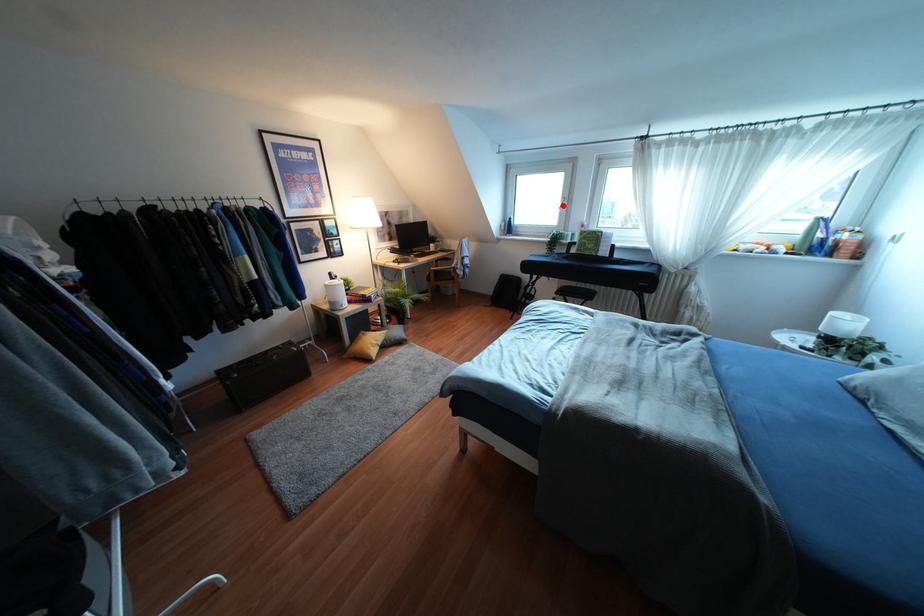
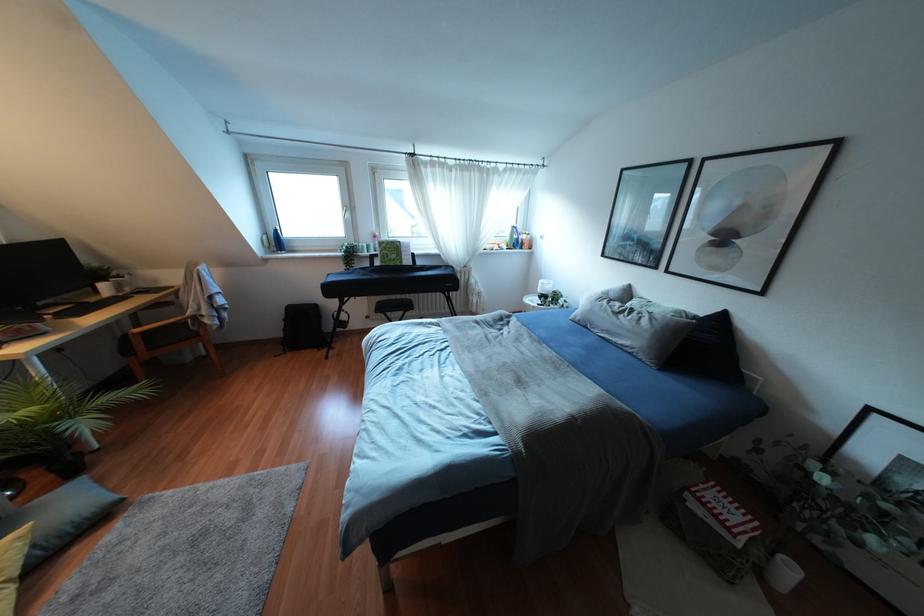
Question: A red point is marked in image1. In image2, is the corresponding 3D point closer to the camera or farther? Reply with the corresponding letter.

Choices:
 (A) The corresponding 3D point is closer.
 (B) The corresponding 3D point is farther.

Answer: (B)